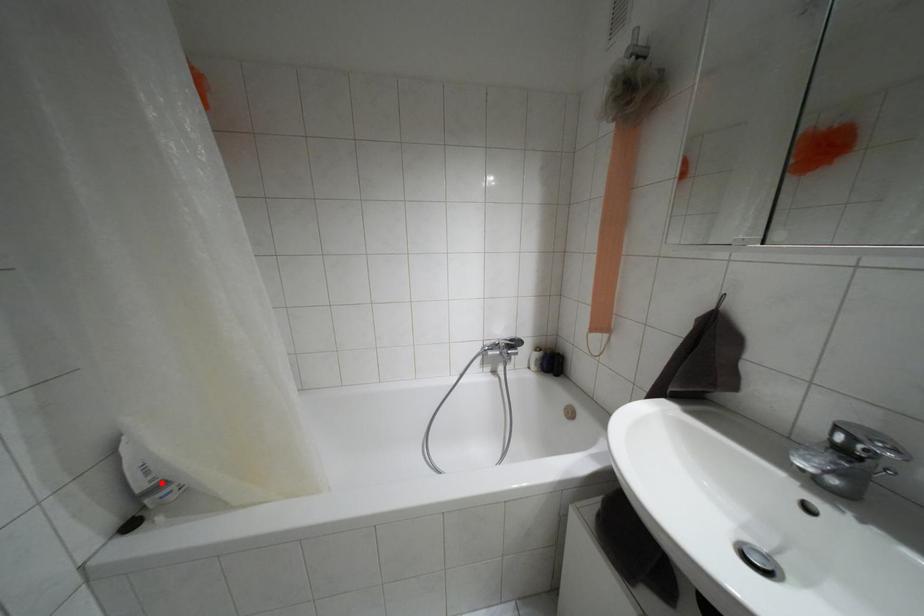
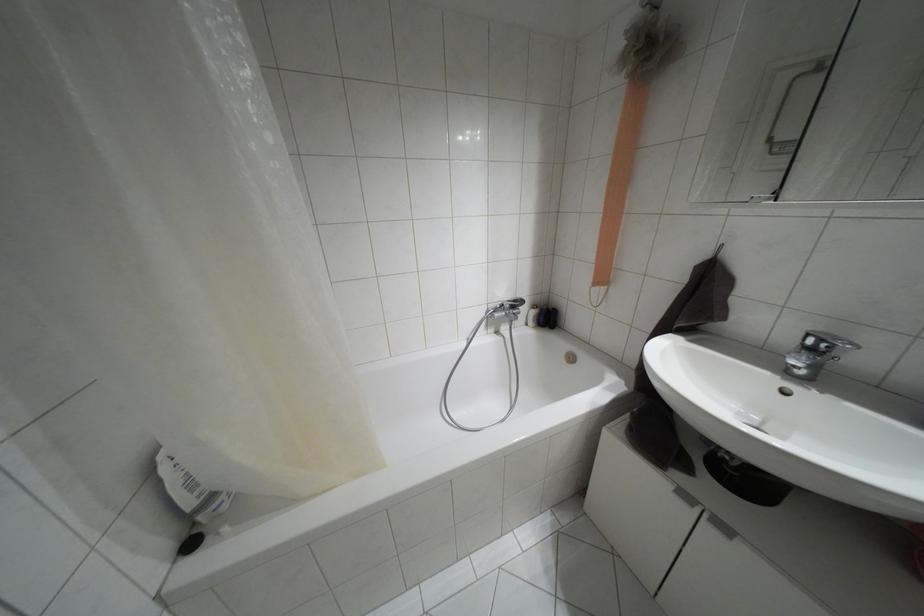
In the second image, find the point that corresponds to the highlighted location in the first image.

(212, 496)